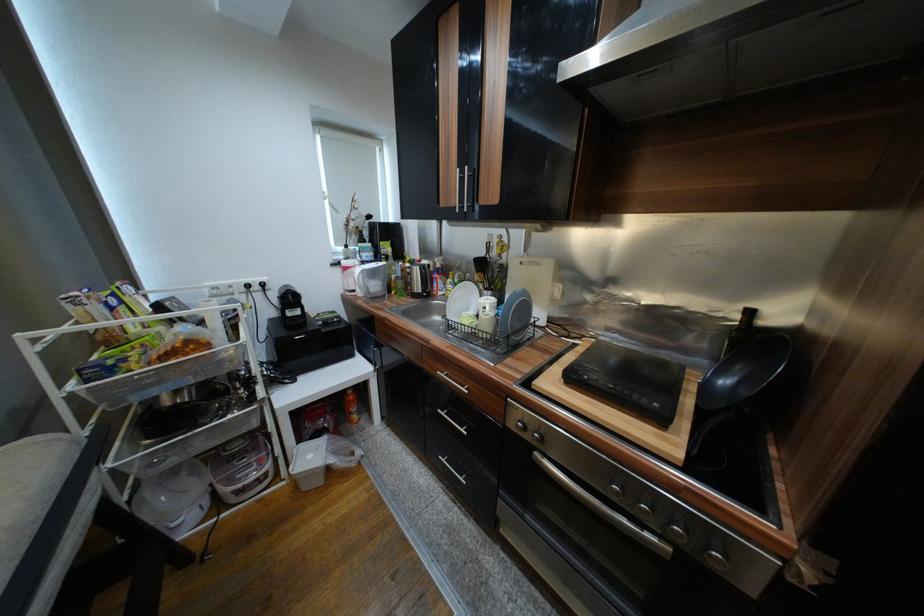
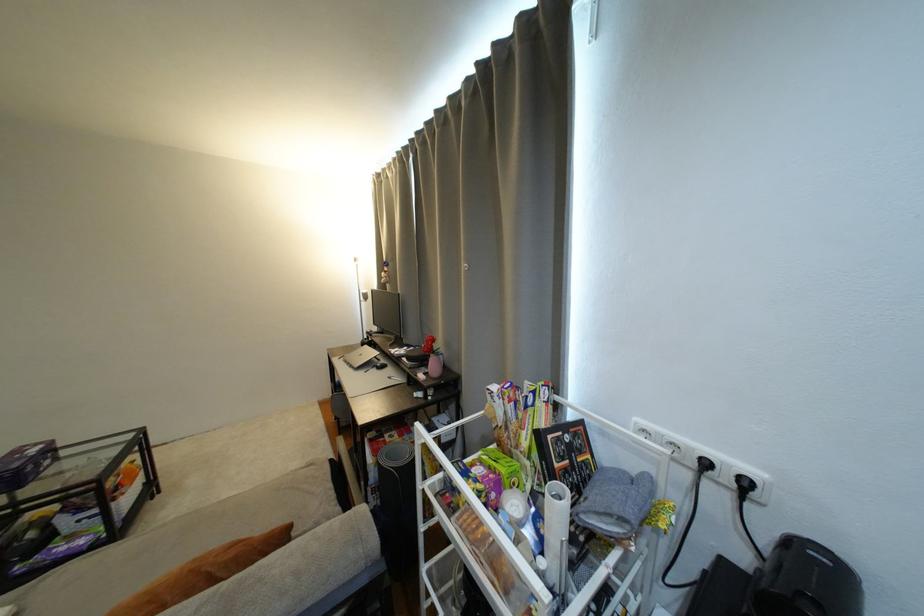
Locate, in the second image, the point that corresponds to (x=272, y=286) in the first image.

(754, 485)